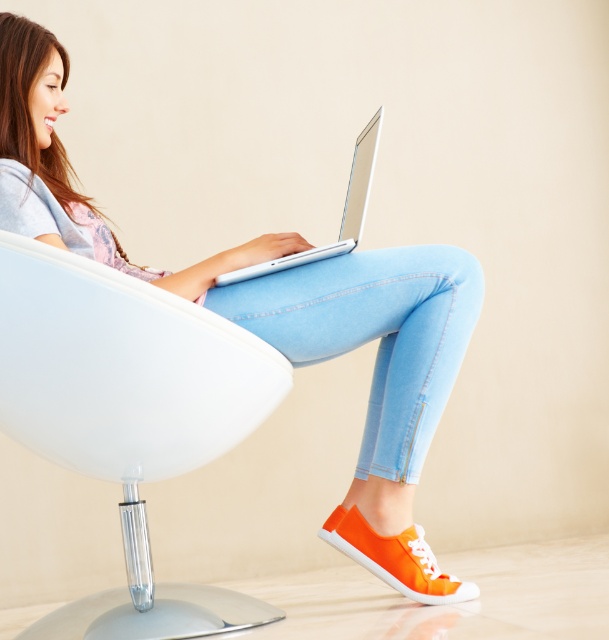
Question: Is matte white laptop at center below silver metallic laptop at center?

Choices:
 (A) yes
 (B) no

Answer: (A)

Question: Considering the relative positions of matte white laptop at center and silver metallic laptop at center in the image provided, where is matte white laptop at center located with respect to silver metallic laptop at center?

Choices:
 (A) below
 (B) above

Answer: (A)

Question: Considering the relative positions of white plastic swivel chair at center and silver metallic laptop at center in the image provided, where is white plastic swivel chair at center located with respect to silver metallic laptop at center?

Choices:
 (A) left
 (B) right

Answer: (A)

Question: Estimate the real-world distances between objects in this image. Which object is closer to the silver metallic laptop at center?

Choices:
 (A) white plastic swivel chair at center
 (B) matte white laptop at center

Answer: (B)

Question: Which of the following is the closest to the observer?

Choices:
 (A) matte white laptop at center
 (B) silver metallic laptop at center

Answer: (B)

Question: Among these objects, which one is nearest to the camera?

Choices:
 (A) white plastic swivel chair at center
 (B) matte white laptop at center

Answer: (A)